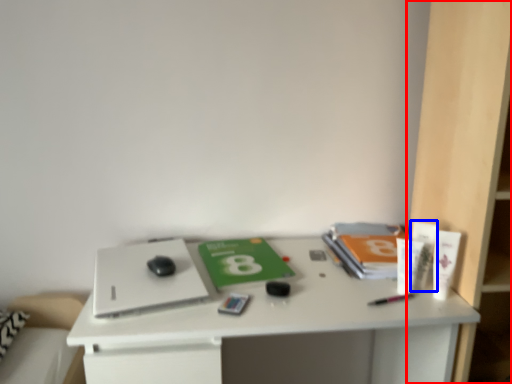
Question: Which of the following is the closest to the observer, bookshelf (highlighted by a red box) or toiletry (highlighted by a blue box)?

Choices:
 (A) bookshelf
 (B) toiletry

Answer: (A)